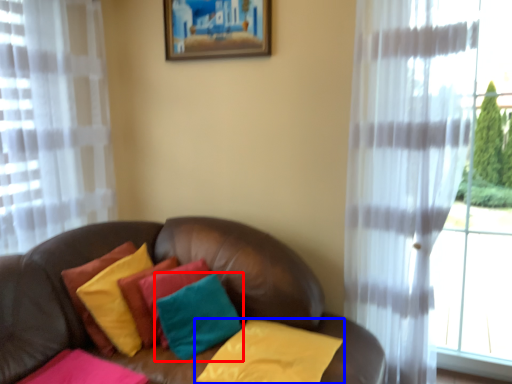
Question: Which of the following is the closest to the observer, pillow (highlighted by a red box) or pillow (highlighted by a blue box)?

Choices:
 (A) pillow
 (B) pillow

Answer: (B)